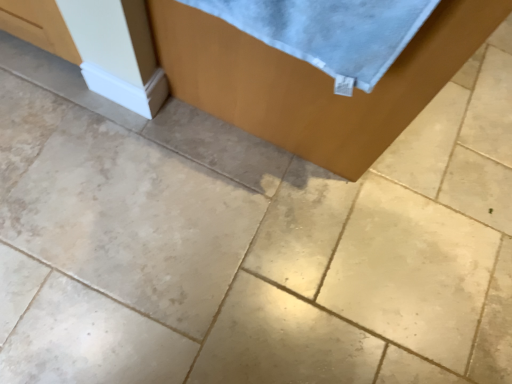
Where is `vacant area situated below light blue cotton towel at upper right (from a real-world perspective)`? The width and height of the screenshot is (512, 384). vacant area situated below light blue cotton towel at upper right (from a real-world perspective) is located at coordinates (250, 148).